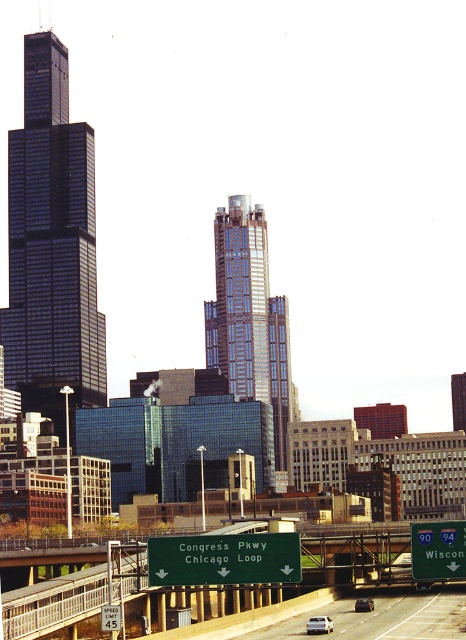
Question: Is white glossy sedan at center thinner than metallic silver sedan at center?

Choices:
 (A) yes
 (B) no

Answer: (B)

Question: Considering the relative positions of white glossy sedan at center and metallic silver sedan at center in the image provided, where is white glossy sedan at center located with respect to metallic silver sedan at center?

Choices:
 (A) left
 (B) right

Answer: (A)

Question: Which point is farther to the camera?

Choices:
 (A) white asphalt highway at lower center
 (B) green matte street sign at center
 (C) white glossy sedan at center

Answer: (C)

Question: Which point is closer to the camera?

Choices:
 (A) (452, 632)
 (B) (317, 620)
 (C) (430, 545)
 (D) (212, 536)

Answer: (D)

Question: Considering the relative positions of green matte street sign at lower right and white glossy sedan at center in the image provided, where is green matte street sign at lower right located with respect to white glossy sedan at center?

Choices:
 (A) left
 (B) right

Answer: (B)

Question: Estimate the real-world distances between objects in this image. Which object is closer to the green matte street sign at center?

Choices:
 (A) green matte street sign at lower right
 (B) white asphalt highway at lower center
 (C) metallic silver sedan at center
 (D) white glossy sedan at center

Answer: (D)